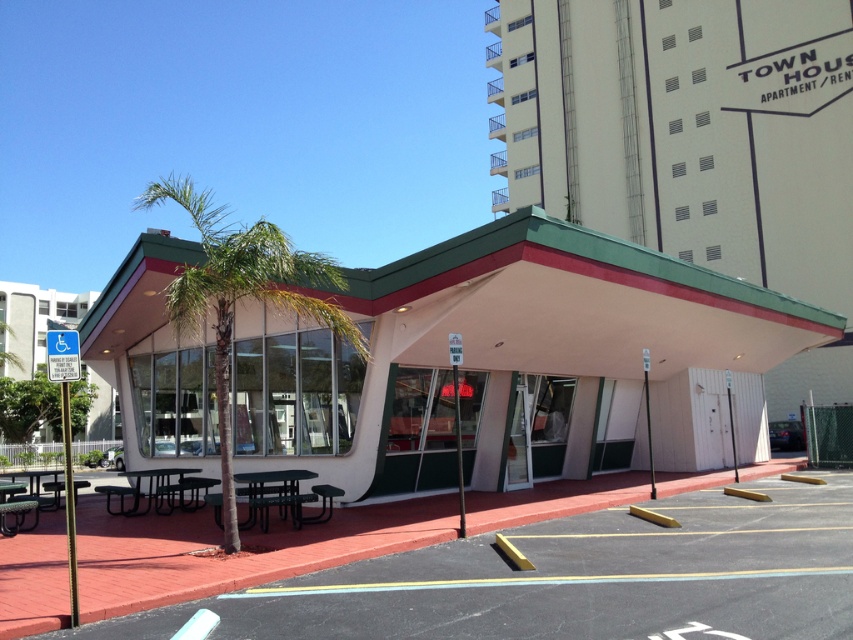
You are a customer entering the diner and need to find a place to sit. You see both the black metal picnic table at center and the green plastic picnic table at center. Which one is located higher up?

The black metal picnic table at center is above the green plastic picnic table at center, so the black metal picnic table at center is higher up.

You are standing at the entrance of the retro diner and want to sit at the black metal picnic table at center. According to the coordinates provided, in which direction should you walk from the entrance to reach the picnic table?

The black metal picnic table at center is located at coordinates point (276, 493), so you should walk towards the center of the diner area from the entrance to reach it.